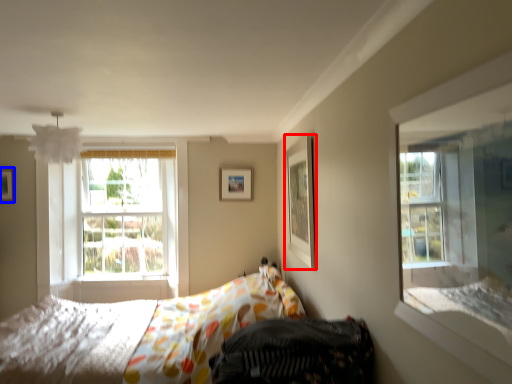
Question: Which point is closer to the camera, picture frame (highlighted by a red box) or picture frame (highlighted by a blue box)?

Choices:
 (A) picture frame
 (B) picture frame

Answer: (A)